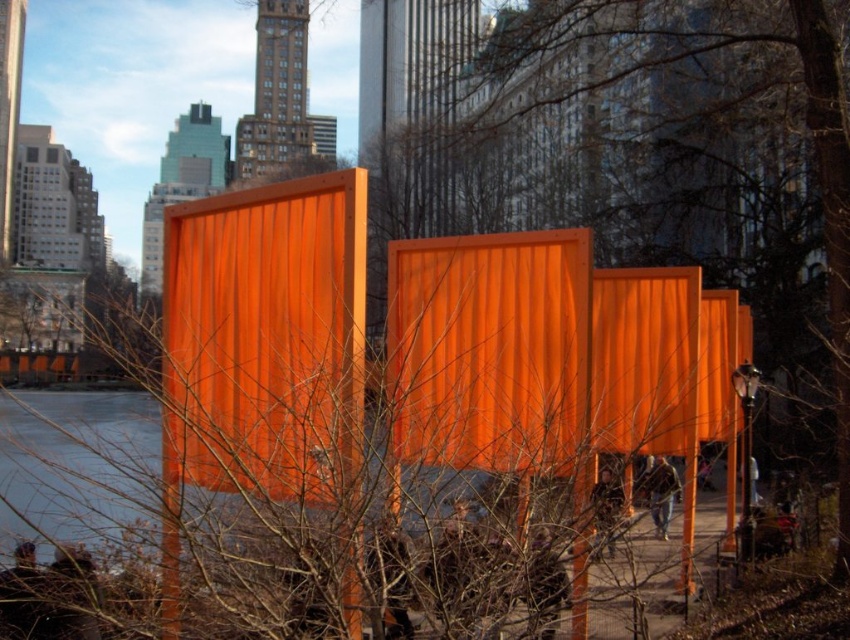
Can you confirm if orange corrugated metal at center is wider than orange corrugated metal shipping container at center?

Indeed, orange corrugated metal at center has a greater width compared to orange corrugated metal shipping container at center.

The height and width of the screenshot is (640, 850). I want to click on orange corrugated metal at center, so click(x=499, y=385).

In the scene shown: Who is more forward, (619, 420) or (299, 476)?

Point (299, 476) is in front.

Find the location of a particular element. orange corrugated metal at center is located at coordinates point(499,385).